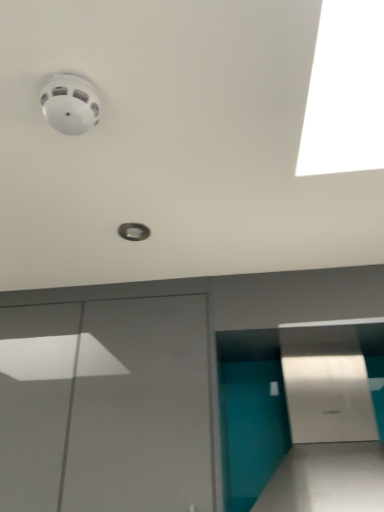
Question: From the image's perspective, is white glossy door at lower left located above or below teal glossy wall at lower right?

Choices:
 (A) below
 (B) above

Answer: (A)

Question: Based on their sizes in the image, would you say white glossy door at lower left is bigger or smaller than teal glossy wall at lower right?

Choices:
 (A) big
 (B) small

Answer: (A)

Question: Is white glossy door at lower left spatially inside teal glossy wall at lower right, or outside of it?

Choices:
 (A) inside
 (B) outside

Answer: (B)

Question: From their relative heights in the image, would you say teal glossy wall at lower right is taller or shorter than white glossy door at lower left?

Choices:
 (A) short
 (B) tall

Answer: (A)

Question: Considering the positions of teal glossy wall at lower right and white glossy door at lower left in the image, is teal glossy wall at lower right bigger or smaller than white glossy door at lower left?

Choices:
 (A) big
 (B) small

Answer: (B)

Question: Is teal glossy wall at lower right inside the boundaries of white glossy door at lower left, or outside?

Choices:
 (A) outside
 (B) inside

Answer: (A)

Question: Visually, is teal glossy wall at lower right positioned to the left or to the right of white glossy door at lower left?

Choices:
 (A) right
 (B) left

Answer: (A)